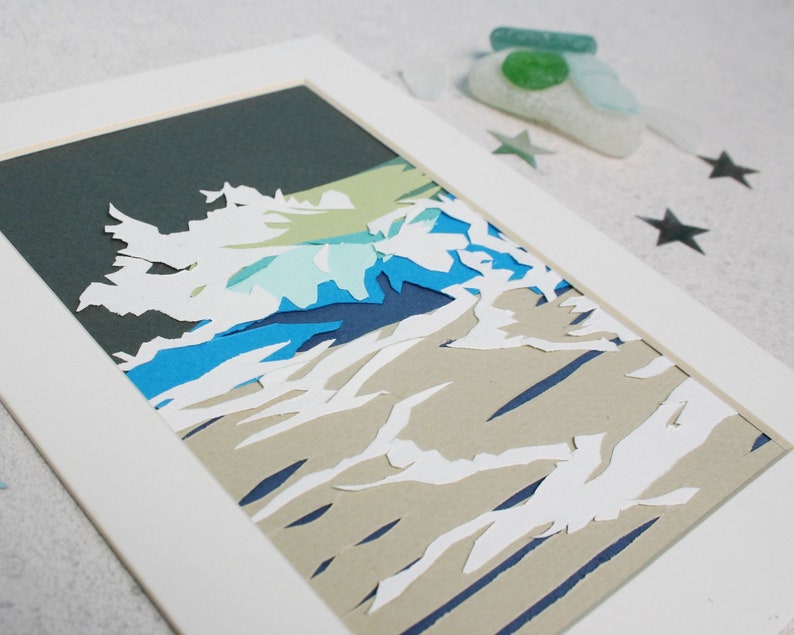
Find the location of a particular element. The image size is (794, 635). white speckled countertop is located at coordinates (757, 272), (44, 580).